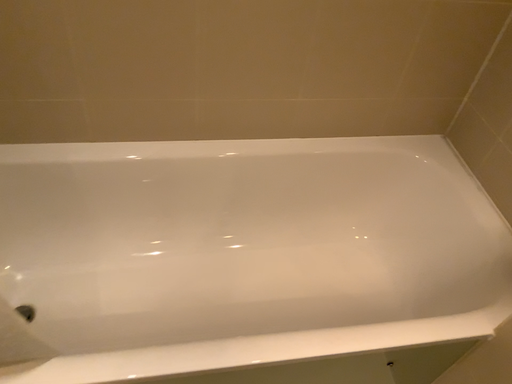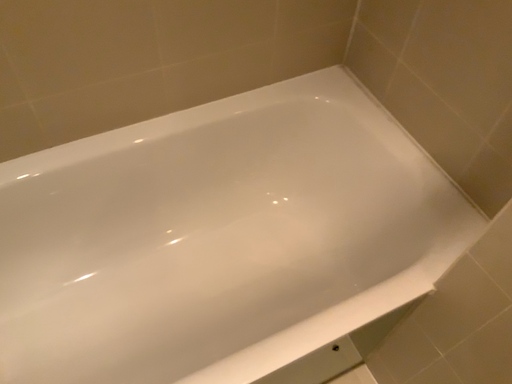
Question: How did the camera likely rotate when shooting the video?

Choices:
 (A) rotated right
 (B) rotated left

Answer: (A)